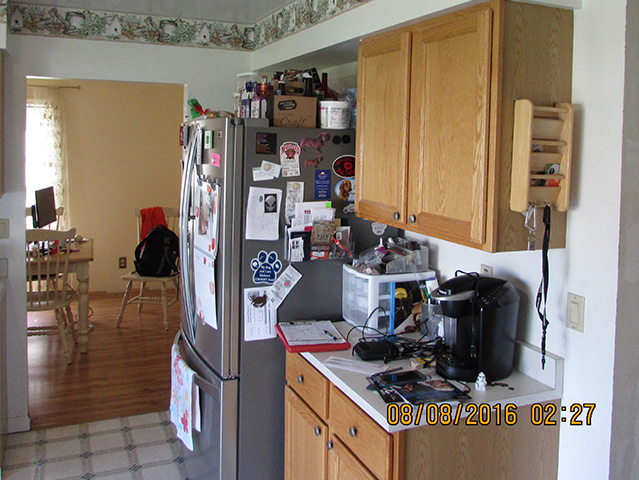
The image size is (639, 480). In order to click on chair leg in this screenshot , I will do `click(124, 306)`, `click(142, 292)`, `click(166, 303)`, `click(64, 333)`, `click(71, 321)`.